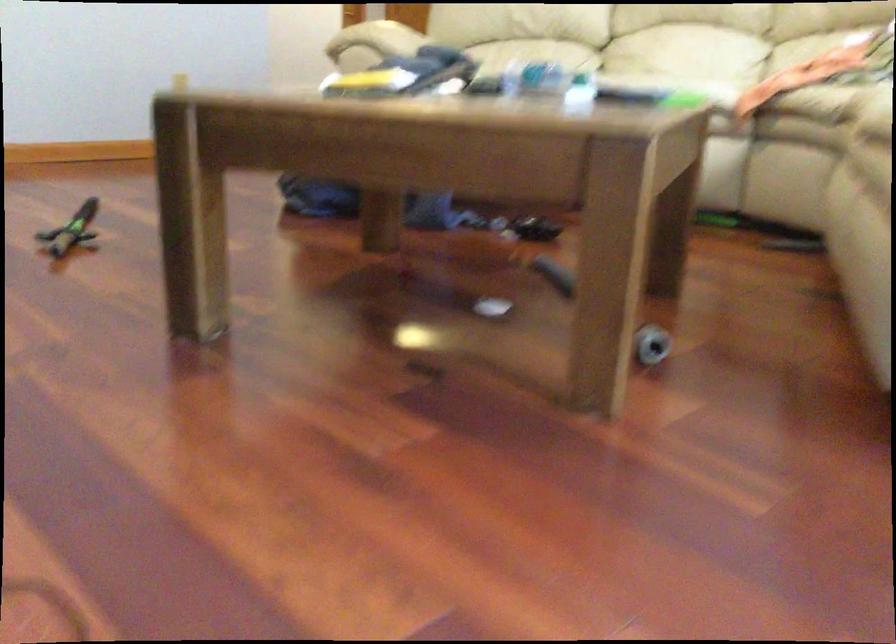
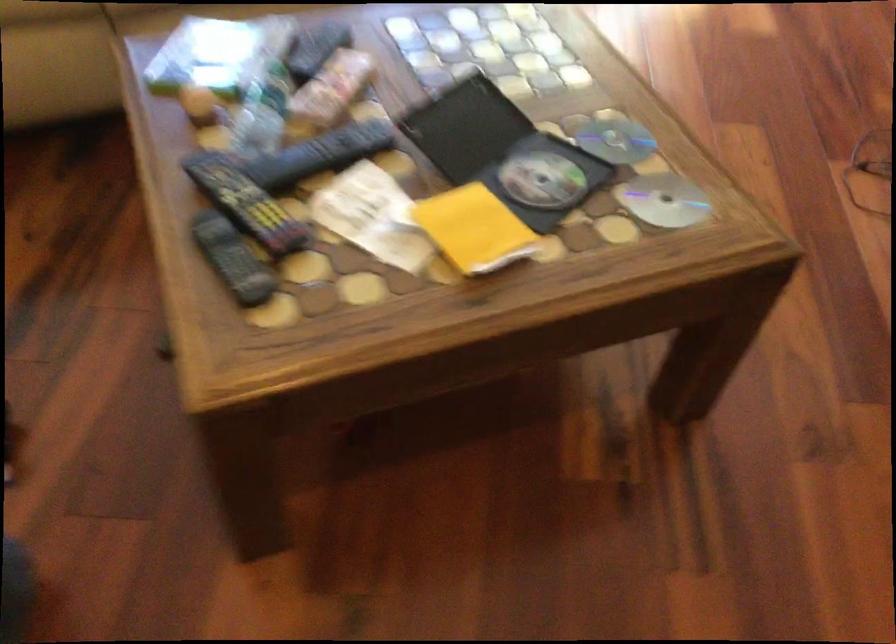
Where in the second image is the point corresponding to point (478, 84) from the first image?

(320, 154)